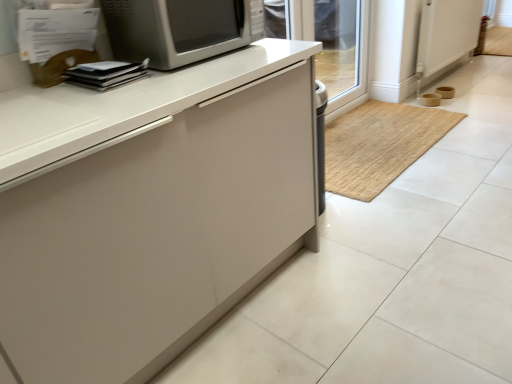
In order to face transparent glass door at upper right, should I rotate leftwards or rightwards?

You should look right and rotate roughly 10.739 degrees.

This screenshot has width=512, height=384. In order to click on satin silver microwave at upper center in this screenshot , I will do `click(175, 29)`.

This screenshot has width=512, height=384. What do you see at coordinates (446, 34) in the screenshot?
I see `white plastic screen door at upper right` at bounding box center [446, 34].

Where is `white plastic screen door at upper right`? white plastic screen door at upper right is located at coordinates (446, 34).

At what (x,y) coordinates should I click in order to perform the action: click on bamboo mat at center. Please return your answer as a coordinate pair (x, y). Looking at the image, I should click on (379, 145).

Locate an element on the screen. Image resolution: width=512 pixels, height=384 pixels. transparent glass door at upper right is located at coordinates (346, 57).

Locate an element on the screen. The width and height of the screenshot is (512, 384). microwave oven that is below the transparent glass door at upper right (from the image's perspective) is located at coordinates (175, 29).

Is satin silver microwave at upper center at the right side of transparent glass door at upper right?

In fact, satin silver microwave at upper center is to the left of transparent glass door at upper right.

Which point is more forward, (x=130, y=8) or (x=368, y=12)?

The point (x=130, y=8) is in front.

Is satin silver microwave at upper center oriented towards transparent glass door at upper right?

No, satin silver microwave at upper center is not turned towards transparent glass door at upper right.

Consider the image. From a real-world perspective, relative to transparent glass door at upper right, is bamboo mat at center vertically above or below?

Clearly, from a real-world perspective, bamboo mat at center is below transparent glass door at upper right.

Can you see bamboo mat at center touching transparent glass door at upper right?

No, bamboo mat at center is not touching transparent glass door at upper right.

Which object is thinner, bamboo mat at center or transparent glass door at upper right?

With smaller width is transparent glass door at upper right.

Which is behind, point (396, 136) or point (322, 57)?

The point (322, 57) is farther.

Considering the relative sizes of bamboo mat at center and white plastic screen door at upper right in the image provided, is bamboo mat at center shorter than white plastic screen door at upper right?

Correct, bamboo mat at center is not as tall as white plastic screen door at upper right.

Considering the positions of point (393, 174) and point (443, 17), is point (393, 174) closer or farther from the camera than point (443, 17)?

Point (393, 174).

Is the position of bamboo mat at center more distant than that of white plastic screen door at upper right?

No, bamboo mat at center is closer to the viewer.

Are white plastic screen door at upper right and satin silver microwave at upper center making contact?

No, white plastic screen door at upper right is not in contact with satin silver microwave at upper center.

How many degrees apart are the facing directions of white plastic screen door at upper right and satin silver microwave at upper center?

white plastic screen door at upper right and satin silver microwave at upper center are facing 1.46 degrees away from each other.

I want to click on screen door below the satin silver microwave at upper center (from a real-world perspective), so click(446, 34).

Based on their positions, is white plastic screen door at upper right located to the left or right of satin silver microwave at upper center?

In the image, white plastic screen door at upper right appears on the right side of satin silver microwave at upper center.

Would you say bamboo mat at center is a long distance from satin silver microwave at upper center?

Absolutely, bamboo mat at center is distant from satin silver microwave at upper center.

Can you confirm if bamboo mat at center is bigger than satin silver microwave at upper center?

Indeed, bamboo mat at center has a larger size compared to satin silver microwave at upper center.

Looking at their sizes, would you say bamboo mat at center is wider or thinner than satin silver microwave at upper center?

Clearly, bamboo mat at center has more width compared to satin silver microwave at upper center.

Consider the image. Is satin silver microwave at upper center positioned with its back to bamboo mat at center?

satin silver microwave at upper center does not have its back to bamboo mat at center.

Consider the image. Is satin silver microwave at upper center taller than bamboo mat at center?

Yes, satin silver microwave at upper center is taller than bamboo mat at center.

Which point is more distant from viewer, (130, 42) or (383, 117)?

Point (383, 117)

Who is bigger, satin silver microwave at upper center or bamboo mat at center?

Bigger between the two is bamboo mat at center.

Could you tell me if matte white cabinet at center is facing transparent glass door at upper right?

No.

From the image's perspective, who appears lower, matte white cabinet at center or transparent glass door at upper right?

matte white cabinet at center is shown below in the image.

Considering the sizes of matte white cabinet at center and transparent glass door at upper right in the image, is matte white cabinet at center wider or thinner than transparent glass door at upper right?

matte white cabinet at center is wider than transparent glass door at upper right.

Where is `cabinetry below the transparent glass door at upper right (from the image's perspective)`? The width and height of the screenshot is (512, 384). cabinetry below the transparent glass door at upper right (from the image's perspective) is located at coordinates (149, 209).

This screenshot has width=512, height=384. Find the location of `microwave oven located below the transparent glass door at upper right (from the image's perspective)`. microwave oven located below the transparent glass door at upper right (from the image's perspective) is located at coordinates (175, 29).

The width and height of the screenshot is (512, 384). What are the coordinates of `glass door lying on the left of bamboo mat at center` in the screenshot? It's located at (346, 57).

When comparing their distances from bamboo mat at center, does transparent glass door at upper right or matte white cabinet at center seem closer?

transparent glass door at upper right is positioned closer to the anchor bamboo mat at center.

Looking at this image, estimate the real-world distances between objects in this image. Which object is further from satin silver microwave at upper center, transparent glass door at upper right or white plastic screen door at upper right?

white plastic screen door at upper right lies further to satin silver microwave at upper center than the other object.

Consider the image. Considering their positions, is white plastic screen door at upper right positioned further to bamboo mat at center than matte white cabinet at center?

matte white cabinet at center.

Estimate the real-world distances between objects in this image. Which object is further from satin silver microwave at upper center, white plastic screen door at upper right or matte white cabinet at center?

Among the two, white plastic screen door at upper right is located further to satin silver microwave at upper center.

Considering their positions, is matte white cabinet at center positioned closer to satin silver microwave at upper center than transparent glass door at upper right?

matte white cabinet at center is closer to satin silver microwave at upper center.

Considering their positions, is matte white cabinet at center positioned further to transparent glass door at upper right than satin silver microwave at upper center?

matte white cabinet at center lies further to transparent glass door at upper right than the other object.

Considering their positions, is transparent glass door at upper right positioned further to satin silver microwave at upper center than matte white cabinet at center?

The object further to satin silver microwave at upper center is transparent glass door at upper right.

Considering their positions, is white plastic screen door at upper right positioned further to satin silver microwave at upper center than bamboo mat at center?

Based on the image, white plastic screen door at upper right appears to be further to satin silver microwave at upper center.

You are a GUI agent. You are given a task and a screenshot of the screen. Output one action in this format:
    pyautogui.click(x=<x>, y=<y>)
    Task: Click on the microwave oven located between matte white cabinet at center and white plastic screen door at upper right in the depth direction
    This screenshot has height=384, width=512.
    Given the screenshot: What is the action you would take?
    pyautogui.click(x=175, y=29)

Identify the location of glass door between matte white cabinet at center and white plastic screen door at upper right in the front-back direction. The image size is (512, 384). (346, 57).

Locate an element on the screen. doormat between transparent glass door at upper right and white plastic screen door at upper right from left to right is located at coordinates (379, 145).

You are a GUI agent. You are given a task and a screenshot of the screen. Output one action in this format:
    pyautogui.click(x=<x>, y=<y>)
    Task: Click on the glass door located between satin silver microwave at upper center and matte white cabinet at center in the left-right direction
    
    Given the screenshot: What is the action you would take?
    pyautogui.click(x=346, y=57)